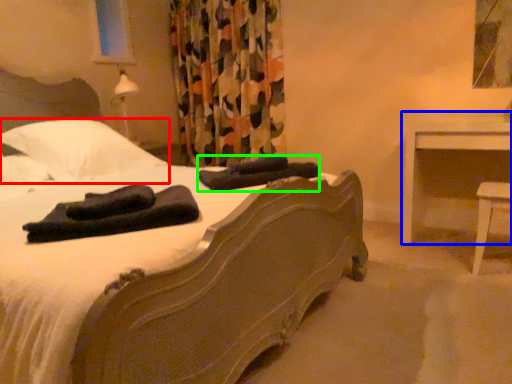
Question: Which is farther away from pillow (highlighted by a red box)? nightstand (highlighted by a blue box) or material (highlighted by a green box)?

Choices:
 (A) nightstand
 (B) material

Answer: (A)